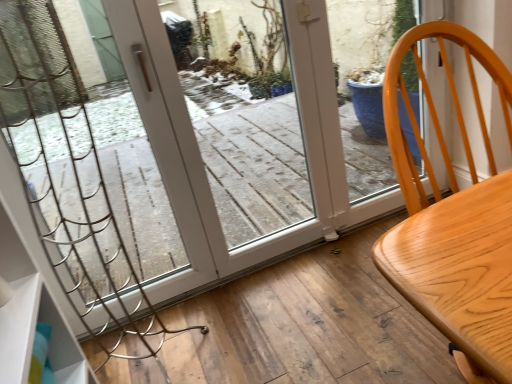
Where is `light brown wood chair at right`? Image resolution: width=512 pixels, height=384 pixels. light brown wood chair at right is located at coordinates (453, 220).

Measure the distance between light brown wood chair at right and camera.

The distance of light brown wood chair at right from camera is 18.97 inches.

This screenshot has height=384, width=512. What do you see at coordinates (453, 220) in the screenshot?
I see `light brown wood chair at right` at bounding box center [453, 220].

Find the location of a particular element. The image size is (512, 384). light brown wood chair at right is located at coordinates (453, 220).